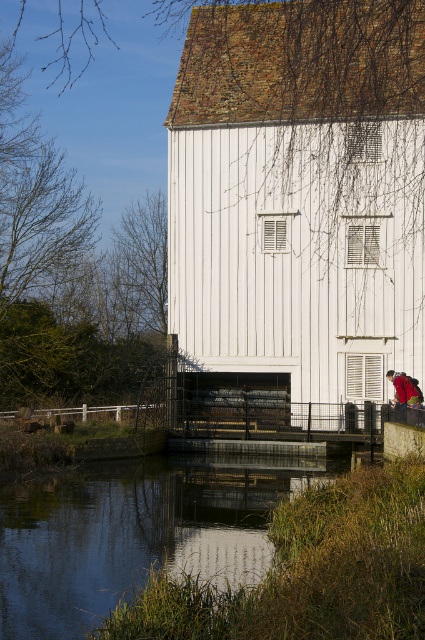
You are planning to place a small decorative boat in the scene. The boat requires a water surface wider than the red fabric backpack at lower right to navigate. Can the smooth reflective water at lower center accommodate it?

The smooth reflective water at lower center has a width larger than the red fabric backpack at lower right, so yes, the boat can navigate on the smooth reflective water at lower center as it meets the required width.

You are standing near the traditional white mill and want to place your red fabric backpack at lower right on the ground. However, you notice the smooth reflective water at lower center. Which object is nearer to you, the viewer, so you can safely place the backpack away from the water?

The smooth reflective water at lower center is closer to the viewer than the red fabric backpack at lower right. Therefore, to place the backpack safely away from the water, you should position it further back from the water since the backpack is farther away.